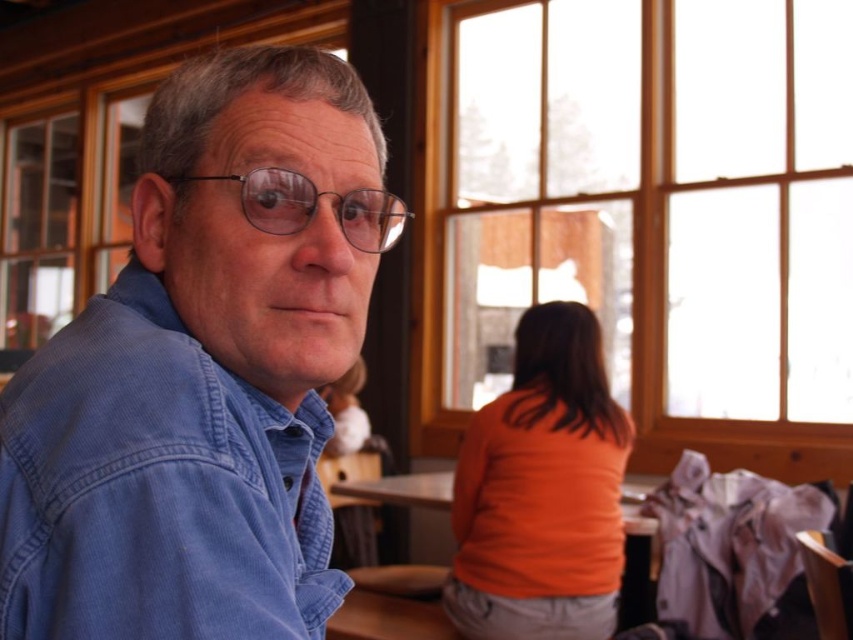
Is the position of denim shirt at left less distant than that of smooth wooden table at center?

Yes.

Between denim shirt at left and smooth wooden table at center, which one appears on the right side from the viewer's perspective?

smooth wooden table at center

Identify the location of denim shirt at left. Image resolution: width=853 pixels, height=640 pixels. (202, 371).

In the scene shown: Who is positioned more to the left, smooth wooden table at center or clear plastic glasses at center?

Positioned to the left is smooth wooden table at center.

Is point (399, 620) positioned before point (352, 212)?

No, (399, 620) is behind (352, 212).

Image resolution: width=853 pixels, height=640 pixels. What are the coordinates of `smooth wooden table at center` in the screenshot? It's located at (412, 506).

Can you confirm if wooden frame at upper right is bigger than smooth wooden table at center?

Yes, wooden frame at upper right is bigger than smooth wooden table at center.

Does wooden frame at upper right have a greater height compared to smooth wooden table at center?

Yes, wooden frame at upper right is taller than smooth wooden table at center.

Describe the element at coordinates (646, 212) in the screenshot. I see `wooden frame at upper right` at that location.

The height and width of the screenshot is (640, 853). What are the coordinates of `wooden frame at upper right` in the screenshot? It's located at (646, 212).